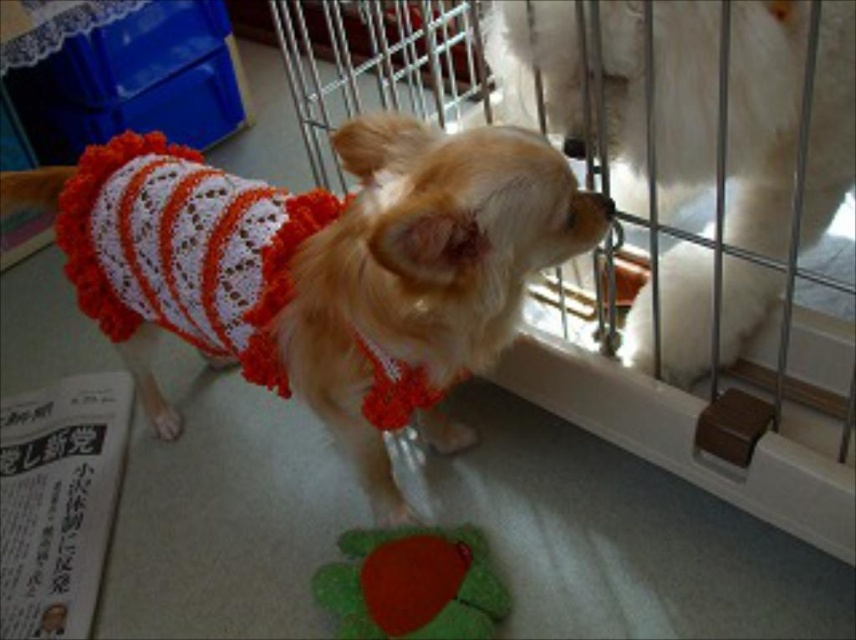
Is white fluffy dog at center above velvety green plush toy at center?

Correct, white fluffy dog at center is located above velvety green plush toy at center.

Between white fluffy dog at center and velvety green plush toy at center, which one has less height?

With less height is velvety green plush toy at center.

Locate an element on the screen. This screenshot has height=640, width=856. white fluffy dog at center is located at coordinates (764, 120).

Which is in front, point (241, 285) or point (807, 332)?

Point (241, 285) is more forward.

The width and height of the screenshot is (856, 640). In order to click on white crochet dress at center in this screenshot , I will do `click(324, 268)`.

Does point (462, 442) come farther from viewer compared to point (571, 147)?

Yes, it is.

The height and width of the screenshot is (640, 856). What do you see at coordinates (324, 268) in the screenshot? I see `white crochet dress at center` at bounding box center [324, 268].

Who is more distant from viewer, (375, 337) or (780, 28)?

The point (780, 28) is more distant.

You are a GUI agent. You are given a task and a screenshot of the screen. Output one action in this format:
    pyautogui.click(x=<x>, y=<y>)
    Task: Click on the white crochet dress at center
    
    Given the screenshot: What is the action you would take?
    pyautogui.click(x=324, y=268)